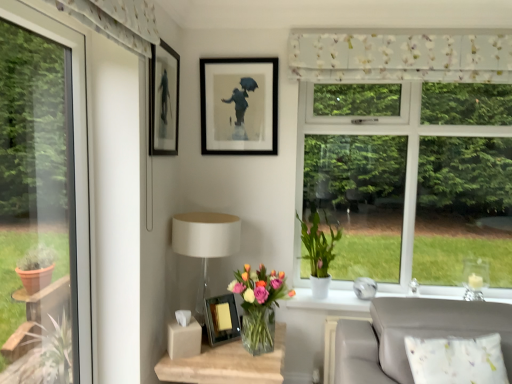
Question: Is floral fabric curtain at upper center taller than white matte pot at window, which ranks as the second houseplant in front-to-back order?

Choices:
 (A) no
 (B) yes

Answer: (A)

Question: From the image's perspective, is floral fabric curtain at upper center on white matte pot at window, which ranks as the second houseplant in front-to-back order?

Choices:
 (A) no
 (B) yes

Answer: (B)

Question: Does floral fabric curtain at upper center have a larger size compared to white matte pot at window, the 2th houseplant from the left?

Choices:
 (A) yes
 (B) no

Answer: (B)

Question: Is floral fabric curtain at upper center facing away from white matte pot at window, which ranks as the second houseplant in front-to-back order?

Choices:
 (A) no
 (B) yes

Answer: (A)

Question: Can you confirm if floral fabric curtain at upper center is positioned to the right of white matte pot at window, arranged as the first houseplant when viewed from the right?

Choices:
 (A) yes
 (B) no

Answer: (A)

Question: Is white matte pot at window, arranged as the first houseplant when viewed from the right, inside or outside of metallic silver picture frame at center, arranged as the third picture frame when viewed from the top?

Choices:
 (A) outside
 (B) inside

Answer: (A)

Question: From their relative heights in the image, would you say white matte pot at window, the 2th houseplant from the left, is taller or shorter than metallic silver picture frame at center, arranged as the 1th picture frame when ordered from the bottom?

Choices:
 (A) tall
 (B) short

Answer: (A)

Question: Based on their positions, is white matte pot at window, which ranks as the second houseplant in front-to-back order, located to the left or right of metallic silver picture frame at center, arranged as the third picture frame when viewed from the top?

Choices:
 (A) right
 (B) left

Answer: (A)

Question: In terms of size, does white matte pot at window, arranged as the 1th houseplant when viewed from the back, appear bigger or smaller than metallic silver picture frame at center, arranged as the third picture frame when viewed from the top?

Choices:
 (A) small
 (B) big

Answer: (B)

Question: Is matte black frame at upper center, placed as the first picture frame when sorted from top to bottom, inside or outside of translucent glass vase at lower center?

Choices:
 (A) outside
 (B) inside

Answer: (A)

Question: In the image, is matte black frame at upper center, the 3th picture frame ordered from the bottom, positioned in front of or behind translucent glass vase at lower center?

Choices:
 (A) behind
 (B) front

Answer: (A)

Question: From a real-world perspective, is matte black frame at upper center, the 3th picture frame ordered from the bottom, positioned above or below translucent glass vase at lower center?

Choices:
 (A) below
 (B) above

Answer: (B)

Question: Would you say matte black frame at upper center, the 3th picture frame ordered from the bottom, is to the left or to the right of translucent glass vase at lower center in the picture?

Choices:
 (A) right
 (B) left

Answer: (A)

Question: Is point (330, 248) closer or farther from the camera than point (159, 112)?

Choices:
 (A) farther
 (B) closer

Answer: (A)

Question: Is white matte pot at window, which ranks as the second houseplant in front-to-back order, bigger or smaller than matte black picture frame at upper left, which is the second picture frame in top-to-bottom order?

Choices:
 (A) small
 (B) big

Answer: (B)